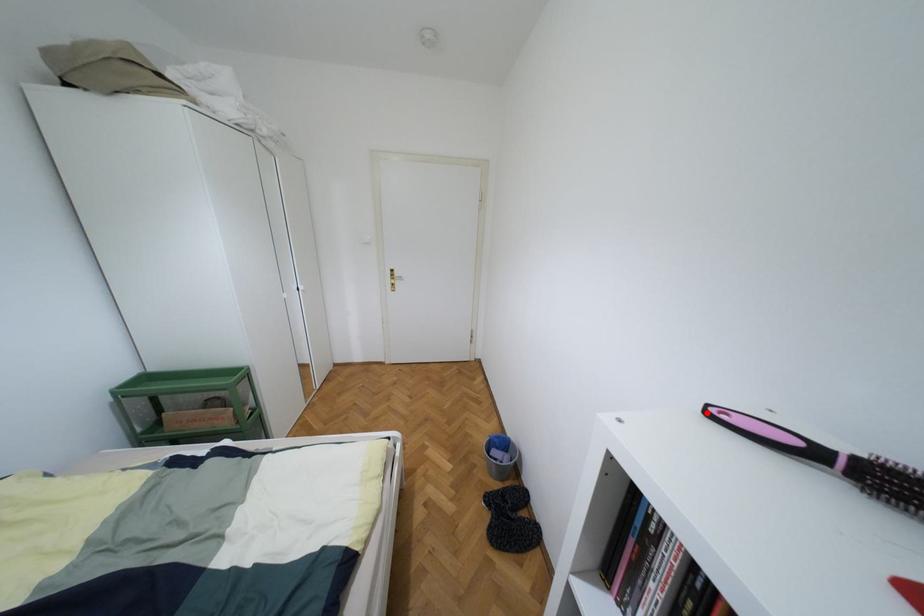
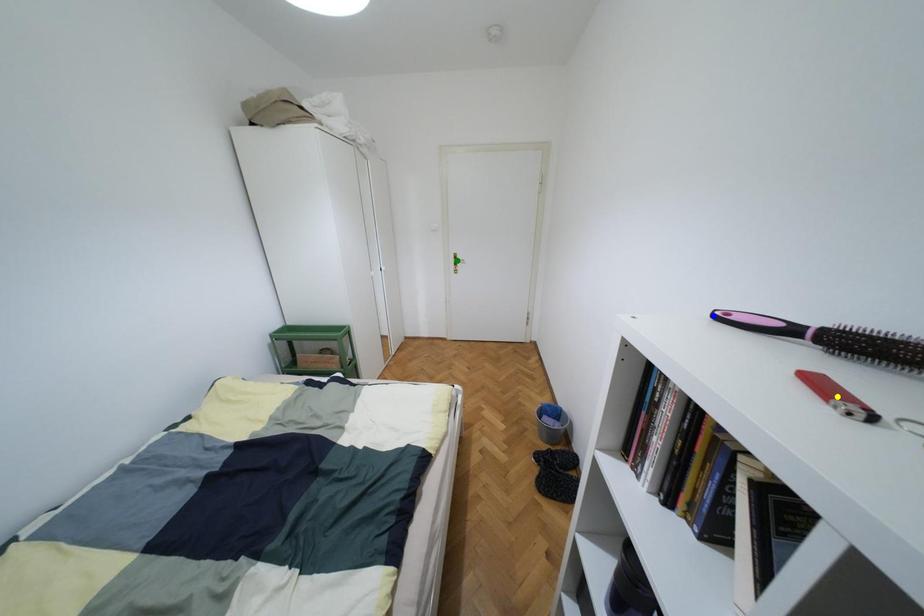
Question: I am providing you with two images of the same scene from different viewpoints. A red point is marked on the first image. You are given multiple points on the second image. Can you choose the point in image 2 that corresponds to the point in image 1?

Choices:
 (A) blue point
 (B) green point
 (C) yellow point

Answer: (A)